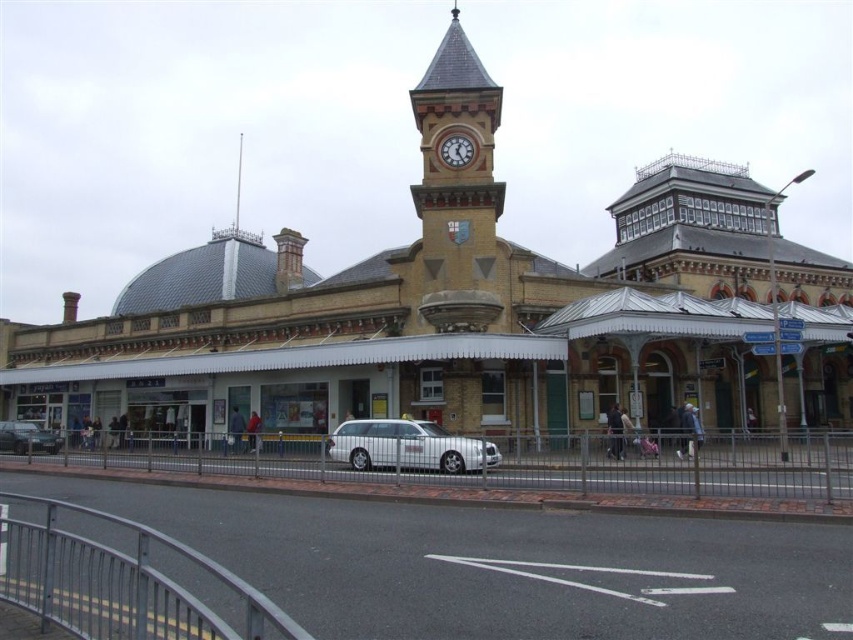
You are standing at the entrance of the historic railway station and want to park your car. The silver metallic station wagon at center is currently occupying a spot. Based on its 2D coordinates, can you determine if it is parked in a no parking zone? The no parking zone is defined as any area with coordinates between 0.6 and 0.8 along the x and y axes.

The silver metallic station wagon at center is located at coordinates [408,445]. Since both the x and y values fall within the no parking zone range of 0.6 to 0.8, the car is parked in the no parking zone.